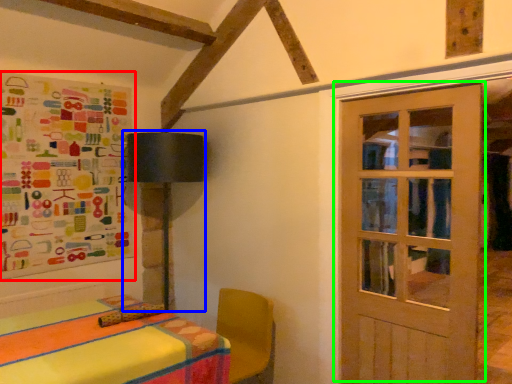
Question: Which object is the farthest from bulletin board (highlighted by a red box)? Choose among these: table lamp (highlighted by a blue box) or door (highlighted by a green box).

Choices:
 (A) table lamp
 (B) door

Answer: (B)